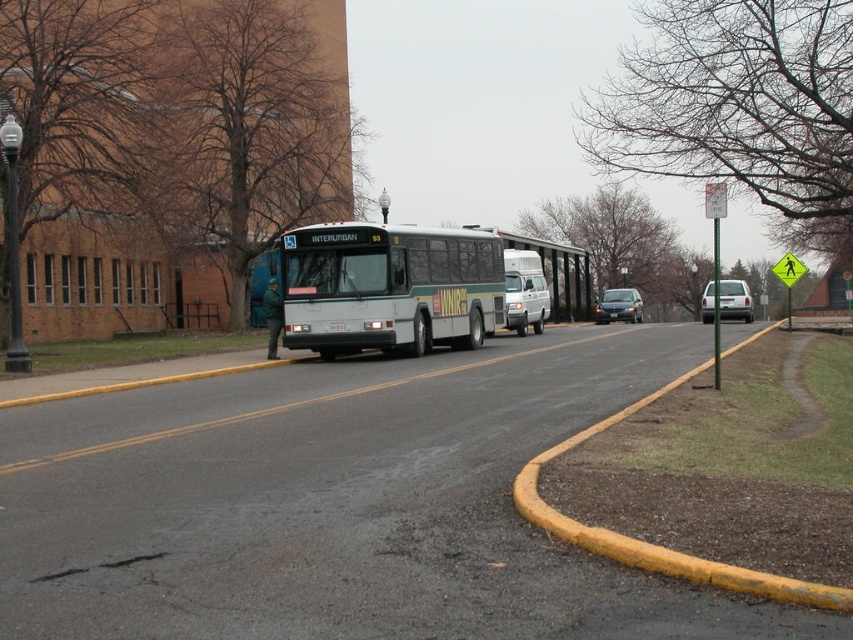
Between silver metallic sedan at right and metallic silver sedan at center, which one is positioned lower?

silver metallic sedan at right

Between silver metallic sedan at right and metallic silver sedan at center, which one is positioned higher?

metallic silver sedan at center is above.

Describe the element at coordinates (735, 300) in the screenshot. This screenshot has width=853, height=640. I see `silver metallic sedan at right` at that location.

Find the location of a particular element. This screenshot has width=853, height=640. silver metallic sedan at right is located at coordinates (735, 300).

Is white matte bus at center further to camera compared to silver metallic sedan at right?

No, white matte bus at center is in front of silver metallic sedan at right.

Does white matte bus at center have a larger size compared to silver metallic sedan at right?

No, white matte bus at center is not bigger than silver metallic sedan at right.

Between point (363, 282) and point (750, 321), which one is positioned behind?

Point (750, 321)

The image size is (853, 640). I want to click on white matte bus at center, so click(x=389, y=288).

Can you confirm if yellow painted curb at lower right is positioned to the right of white matte van at center?

Yes, yellow painted curb at lower right is to the right of white matte van at center.

Which is in front, point (537, 458) or point (506, 257)?

Point (537, 458) is in front.

You are a GUI agent. You are given a task and a screenshot of the screen. Output one action in this format:
    pyautogui.click(x=<x>, y=<y>)
    Task: Click on the yellow painted curb at lower right
    
    Given the screenshot: What is the action you would take?
    pyautogui.click(x=654, y=545)